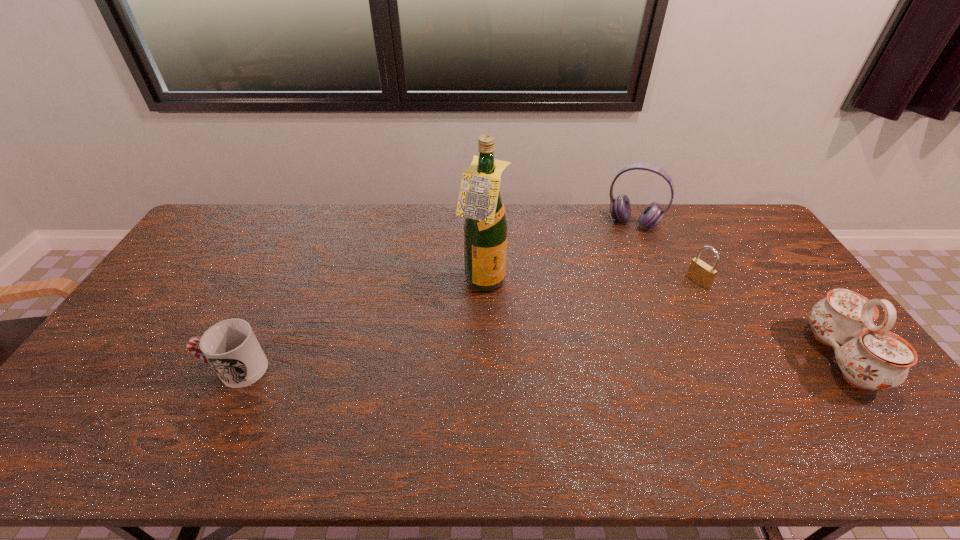
Identify the location of blank space located 0.300m by the handle of the rightmost object. This screenshot has height=540, width=960. coord(705,357).

This screenshot has width=960, height=540. Find the location of `vacant space located 0.100m by the handle of the rightmost object`. vacant space located 0.100m by the handle of the rightmost object is located at coordinates (779, 357).

Locate an element on the screen. Image resolution: width=960 pixels, height=540 pixels. free location located on the headband and ear cups of the farthest object is located at coordinates (621, 242).

The image size is (960, 540). Find the location of `free space located on the headband and ear cups of the farthest object`. free space located on the headband and ear cups of the farthest object is located at coordinates (621, 244).

Image resolution: width=960 pixels, height=540 pixels. I want to click on free space located 0.390m on the headband and ear cups of the farthest object, so click(596, 302).

The height and width of the screenshot is (540, 960). In order to click on free space located 0.060m on the front-facing side of the padlock in this screenshot , I will do pyautogui.click(x=680, y=293).

Where is `blank space located 0.070m on the front-facing side of the padlock`? blank space located 0.070m on the front-facing side of the padlock is located at coordinates (678, 294).

You are a GUI agent. You are given a task and a screenshot of the screen. Output one action in this format:
    pyautogui.click(x=<x>, y=<y>)
    Task: Click on the vacant space located 0.200m on the front-facing side of the padlock
    
    Given the screenshot: What is the action you would take?
    pyautogui.click(x=648, y=310)

This screenshot has width=960, height=540. Find the location of `free space located 0.220m on the front-facing side of the liquor`. free space located 0.220m on the front-facing side of the liquor is located at coordinates (563, 329).

You are a GUI agent. You are given a task and a screenshot of the screen. Output one action in this format:
    pyautogui.click(x=<x>, y=<y>)
    Task: Click on the vacant area situated on the front-facing side of the liquor
    The width and height of the screenshot is (960, 540).
    Given the screenshot: What is the action you would take?
    pyautogui.click(x=581, y=340)